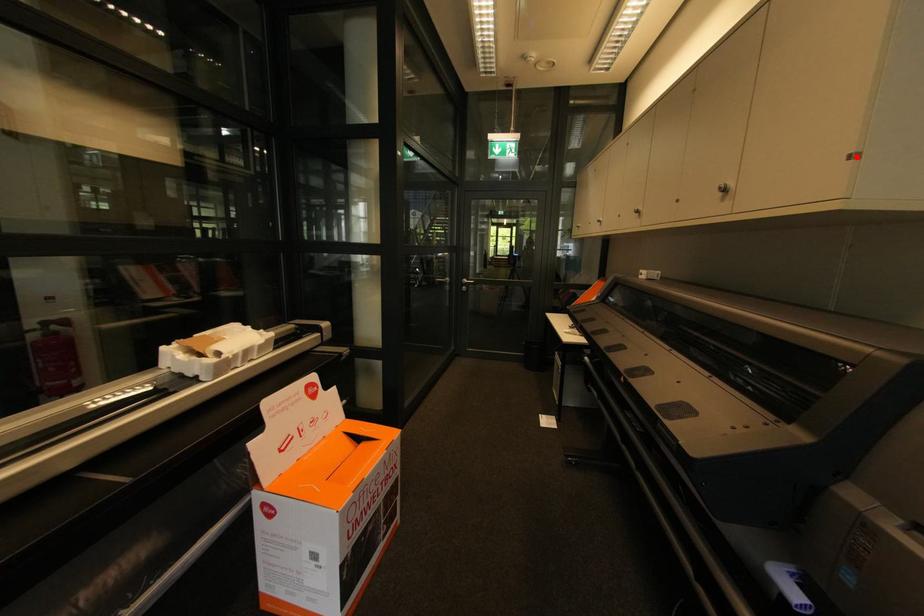
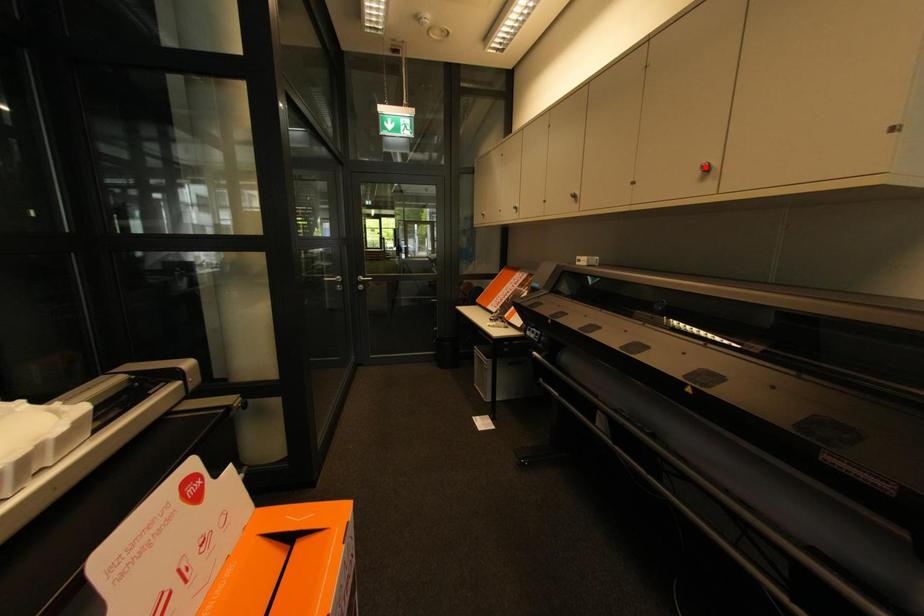
I am providing you with two images of the same scene from different viewpoints. A red point is marked on the first image and another point is marked on the second image. Is the red point in image1 aligned with the point shown in image2?

No